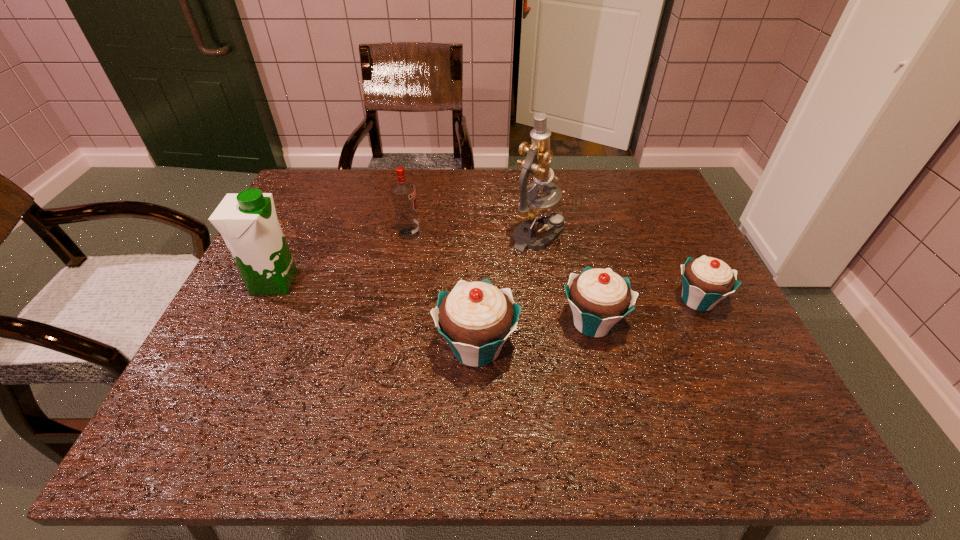
Please point a spot on the left to add another cupcake. Please provide its 2D coordinates. Your answer should be formatted as a tuple, i.e. [(x, y)], where the tuple contains the x and y coordinates of a point satisfying the conditions above.

[(348, 375)]